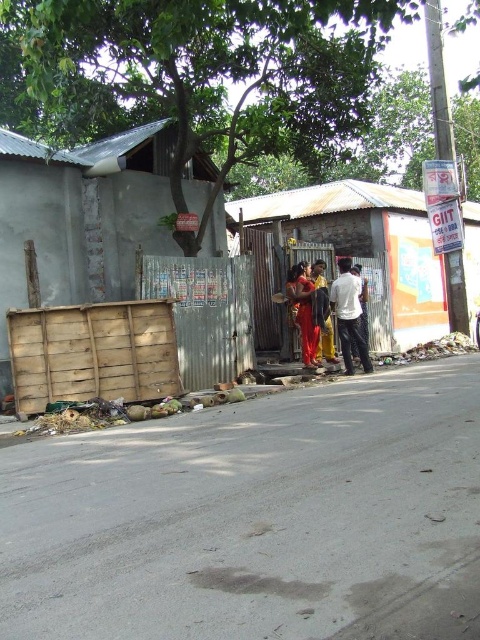
You are standing at the point labeled point [367,248] in the image. What object are you facing?

The point [367,248] corresponds to the metallic corrugated hut at center, so you are facing the metallic corrugated hut at center.